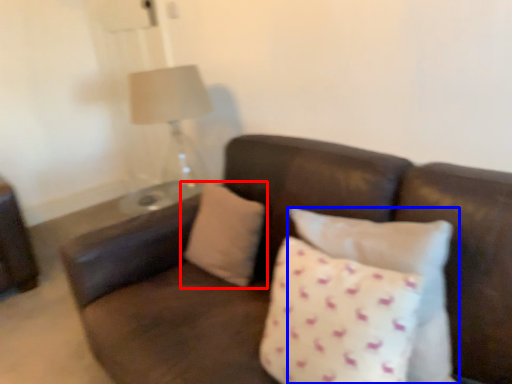
Question: Which point is further to the camera, pillow (highlighted by a red box) or pillow (highlighted by a blue box)?

Choices:
 (A) pillow
 (B) pillow

Answer: (A)